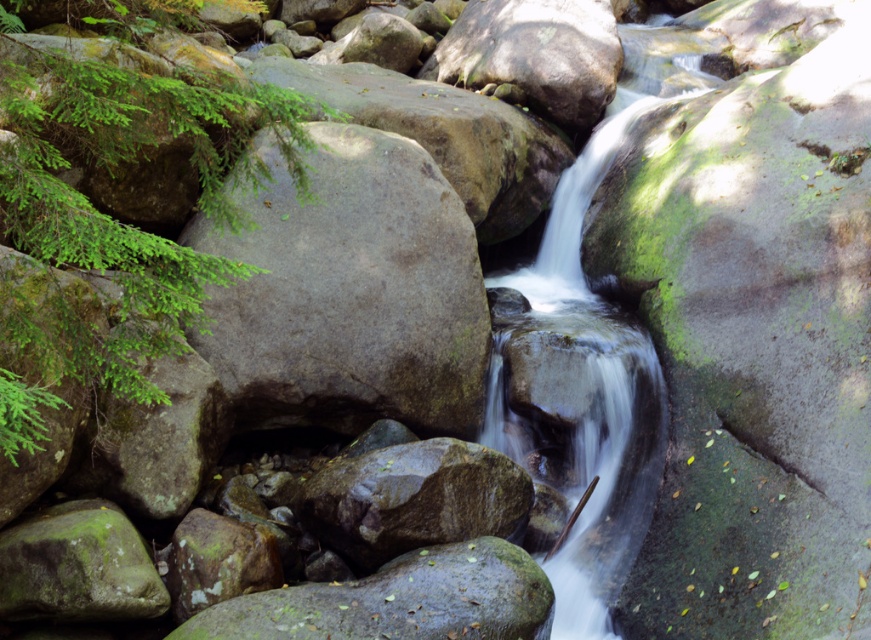
Question: Which is nearer to the clear water at center?

Choices:
 (A) gray rough boulder at center-left
 (B) green mossy rock at center

Answer: (A)

Question: Is gray rough boulder at center-left bigger than clear water at center?

Choices:
 (A) yes
 (B) no

Answer: (A)

Question: Can you confirm if clear water at center is positioned to the right of green mossy rock at center?

Choices:
 (A) yes
 (B) no

Answer: (A)

Question: Which point is closer to the camera?

Choices:
 (A) gray rough boulder at center-left
 (B) clear water at center

Answer: (A)

Question: Which point appears closest to the camera in this image?

Choices:
 (A) (279, 180)
 (B) (623, 106)
 (C) (174, 632)

Answer: (C)

Question: Can you confirm if gray rough boulder at center-left is smaller than clear water at center?

Choices:
 (A) yes
 (B) no

Answer: (B)